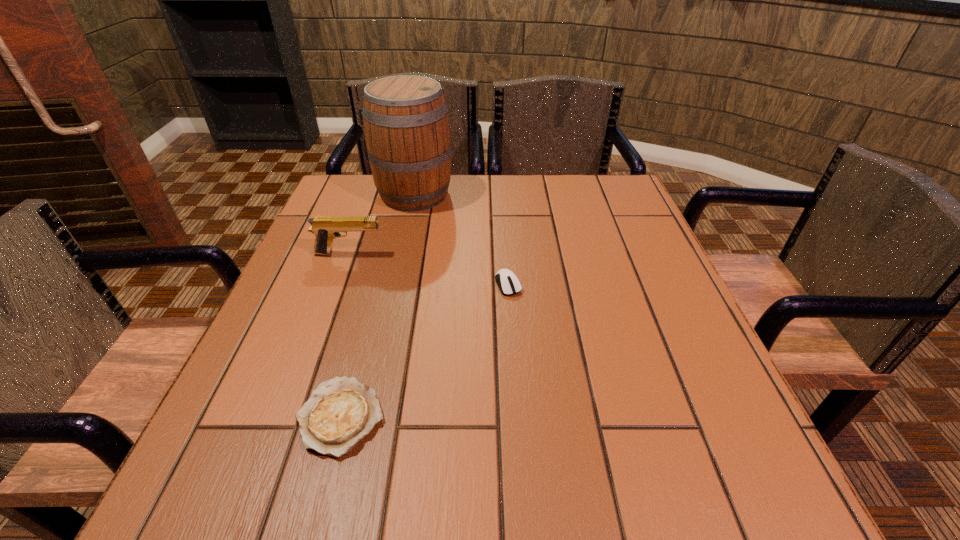
Find the location of a particular element. blank space at the near edge of the desktop is located at coordinates (388, 499).

Find the location of a particular element. The width and height of the screenshot is (960, 540). vacant space at the left edge is located at coordinates (318, 276).

In the image, there is a desktop. Where is `vacant area at the right edge`? vacant area at the right edge is located at coordinates (616, 308).

Image resolution: width=960 pixels, height=540 pixels. Find the location of `vacant area at the near left corner`. vacant area at the near left corner is located at coordinates (277, 488).

In order to click on vacant space at the far right corner of the desktop in this screenshot , I will do pos(578,197).

Identify the location of free space at the near right corner. This screenshot has height=540, width=960. (752, 499).

Find the location of a particular element. This screenshot has height=540, width=960. free point between the pistol and the cider is located at coordinates (382, 224).

The image size is (960, 540). Find the location of `free space that is in between the third nearest object and the tallest object`. free space that is in between the third nearest object and the tallest object is located at coordinates pos(382,224).

This screenshot has height=540, width=960. Identify the location of unoccupied area between the cider and the mouse. (461, 239).

Find the location of a particular element. free space between the shortest object and the second shortest object is located at coordinates (424, 350).